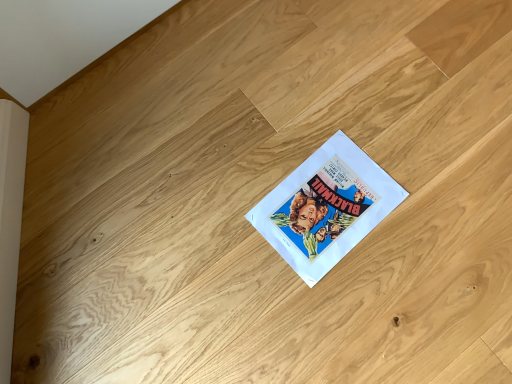
Locate an element on the screen. This screenshot has height=384, width=512. vacant location behind white paper at center is located at coordinates (302, 117).